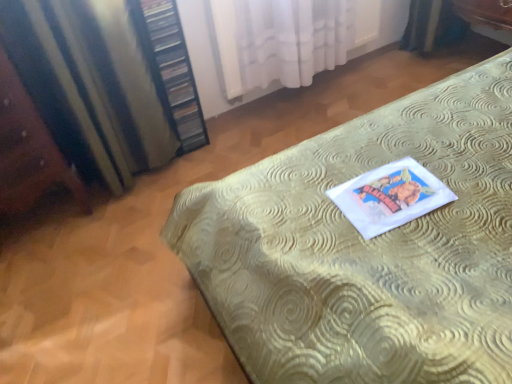
How much space does white sheer curtain at upper center, which appears as the 1th curtain when viewed from the right, occupy horizontally?

The width of white sheer curtain at upper center, which appears as the 1th curtain when viewed from the right, is 3.00 inches.

Describe the element at coordinates (366, 247) in the screenshot. I see `gold textured bed at center` at that location.

What do you see at coordinates (28, 150) in the screenshot? The width and height of the screenshot is (512, 384). I see `brown wooden vanity at left` at bounding box center [28, 150].

Describe the element at coordinates (172, 69) in the screenshot. I see `wooden bookshelf at left` at that location.

The image size is (512, 384). I want to click on white sheer curtain at upper center, which appears as the 1th curtain when viewed from the right, so click(280, 40).

Locate an element on the screen. curtain that is on the right side of satin striped curtain at left, which is the 1th curtain in left-to-right order is located at coordinates (280, 40).

Which object is closer to the camera, satin striped curtain at left, positioned as the second curtain in right-to-left order, or white sheer curtain at upper center, which appears as the 1th curtain when viewed from the right?

satin striped curtain at left, positioned as the second curtain in right-to-left order, is closer to the camera.

Between satin striped curtain at left, which is the 1th curtain in left-to-right order, and white sheer curtain at upper center, which appears as the 1th curtain when viewed from the right, which one appears on the right side from the viewer's perspective?

Positioned to the right is white sheer curtain at upper center, which appears as the 1th curtain when viewed from the right.

From the image's perspective, between satin striped curtain at left, which is the 1th curtain in left-to-right order, and white sheer curtain at upper center, which is the second curtain from left to right, which one is located above?

white sheer curtain at upper center, which is the second curtain from left to right, from the image's perspective.

Is wooden bookshelf at left positioned beyond the bounds of brown wooden vanity at left?

wooden bookshelf at left lies outside brown wooden vanity at left's area.

From a real-world perspective, is wooden bookshelf at left physically located above or below brown wooden vanity at left?

wooden bookshelf at left is situated lower than brown wooden vanity at left in the real world.

Which of these two, wooden bookshelf at left or brown wooden vanity at left, is smaller?

Smaller between the two is wooden bookshelf at left.

Could you measure the distance between wooden bookshelf at left and white sheer curtain at upper center, which is the second curtain from left to right?

wooden bookshelf at left and white sheer curtain at upper center, which is the second curtain from left to right, are 16.35 inches apart.

From a real-world perspective, is wooden bookshelf at left below white sheer curtain at upper center, which appears as the 1th curtain when viewed from the right?

Incorrect, from a real-world perspective, wooden bookshelf at left is higher than white sheer curtain at upper center, which appears as the 1th curtain when viewed from the right.

Does wooden bookshelf at left lie in front of white sheer curtain at upper center, which is the second curtain from left to right?

Yes, it is.

In the scene shown: Which object is positioned more to the right, wooden bookshelf at left or white sheer curtain at upper center, which is the second curtain from left to right?

From the viewer's perspective, white sheer curtain at upper center, which is the second curtain from left to right, appears more on the right side.

Is brown wooden vanity at left not close to wooden bookshelf at left?

They are positioned close to each other.

Between brown wooden vanity at left and wooden bookshelf at left, which one has larger width?

Wider between the two is brown wooden vanity at left.

Considering their positions, is brown wooden vanity at left located in front of or behind wooden bookshelf at left?

Visually, brown wooden vanity at left is located in front of wooden bookshelf at left.

Considering the sizes of objects white sheer curtain at upper center, which is the second curtain from left to right, and brown wooden vanity at left in the image provided, who is shorter, white sheer curtain at upper center, which is the second curtain from left to right, or brown wooden vanity at left?

white sheer curtain at upper center, which is the second curtain from left to right.

Is white sheer curtain at upper center, which appears as the 1th curtain when viewed from the right, oriented away from brown wooden vanity at left?

No, white sheer curtain at upper center, which appears as the 1th curtain when viewed from the right, is not facing away from brown wooden vanity at left.

From a real-world perspective, is white sheer curtain at upper center, which appears as the 1th curtain when viewed from the right, located higher than brown wooden vanity at left?

No, from a real-world perspective, white sheer curtain at upper center, which appears as the 1th curtain when viewed from the right, is not over brown wooden vanity at left

Can you tell me how much white sheer curtain at upper center, which is the second curtain from left to right, and brown wooden vanity at left differ in facing direction?

The angle between the facing direction of white sheer curtain at upper center, which is the second curtain from left to right, and the facing direction of brown wooden vanity at left is 0.646 degrees.

Which of these two, brown wooden vanity at left or gold textured bed at center, is bigger?

With larger size is gold textured bed at center.

Is point (46, 168) closer or farther from the camera than point (423, 292)?

Point (46, 168) is farther from the camera than point (423, 292).

Which object is positioned more to the right, brown wooden vanity at left or gold textured bed at center?

gold textured bed at center.

Does satin striped curtain at left, positioned as the second curtain in right-to-left order, touch brown wooden vanity at left?

No, satin striped curtain at left, positioned as the second curtain in right-to-left order, is not touching brown wooden vanity at left.

Considering the positions of objects satin striped curtain at left, positioned as the second curtain in right-to-left order, and brown wooden vanity at left in the image provided, who is behind, satin striped curtain at left, positioned as the second curtain in right-to-left order, or brown wooden vanity at left?

satin striped curtain at left, positioned as the second curtain in right-to-left order, is behind.

Considering the relative sizes of satin striped curtain at left, positioned as the second curtain in right-to-left order, and brown wooden vanity at left in the image provided, is satin striped curtain at left, positioned as the second curtain in right-to-left order, shorter than brown wooden vanity at left?

No.

Locate an element on the screen. curtain below the white sheer curtain at upper center, which appears as the 1th curtain when viewed from the right (from the image's perspective) is located at coordinates (89, 85).

In the image, there is a brown wooden vanity at left. Where is `bookshelf above it (from the image's perspective)`? This screenshot has height=384, width=512. bookshelf above it (from the image's perspective) is located at coordinates (172, 69).

From the image, which object appears to be farther from brown wooden vanity at left, wooden bookshelf at left or gold textured bed at center?

The object further to brown wooden vanity at left is gold textured bed at center.

From the image, which object appears to be farther from gold textured bed at center, brown wooden vanity at left or satin striped curtain at left, positioned as the second curtain in right-to-left order?

Result: brown wooden vanity at left lies further to gold textured bed at center than the other object.

Considering their positions, is satin striped curtain at left, which is the 1th curtain in left-to-right order, positioned closer to wooden bookshelf at left than gold textured bed at center?

satin striped curtain at left, which is the 1th curtain in left-to-right order, lies closer to wooden bookshelf at left than the other object.

When comparing their distances from wooden bookshelf at left, does brown wooden vanity at left or white sheer curtain at upper center, which appears as the 1th curtain when viewed from the right, seem further?

brown wooden vanity at left lies further to wooden bookshelf at left than the other object.

Based on their spatial positions, is brown wooden vanity at left or white sheer curtain at upper center, which is the second curtain from left to right, further from satin striped curtain at left, positioned as the second curtain in right-to-left order?

Based on the image, white sheer curtain at upper center, which is the second curtain from left to right, appears to be further to satin striped curtain at left, positioned as the second curtain in right-to-left order.

Looking at the image, which one is located further to white sheer curtain at upper center, which appears as the 1th curtain when viewed from the right, wooden bookshelf at left or gold textured bed at center?

gold textured bed at center is further to white sheer curtain at upper center, which appears as the 1th curtain when viewed from the right.

When comparing their distances from white sheer curtain at upper center, which appears as the 1th curtain when viewed from the right, does gold textured bed at center or satin striped curtain at left, positioned as the second curtain in right-to-left order, seem further?

Based on the image, gold textured bed at center appears to be further to white sheer curtain at upper center, which appears as the 1th curtain when viewed from the right.

Estimate the real-world distances between objects in this image. Which object is further from wooden bookshelf at left, gold textured bed at center or satin striped curtain at left, positioned as the second curtain in right-to-left order?

Among the two, gold textured bed at center is located further to wooden bookshelf at left.

At what (x,y) coordinates should I click in order to perform the action: click on vanity located between gold textured bed at center and white sheer curtain at upper center, which appears as the 1th curtain when viewed from the right, in the depth direction. Please return your answer as a coordinate pair (x, y). The image size is (512, 384). Looking at the image, I should click on (28, 150).

Identify the location of bookshelf between brown wooden vanity at left and gold textured bed at center. The image size is (512, 384). (172, 69).

Image resolution: width=512 pixels, height=384 pixels. I want to click on bookshelf between gold textured bed at center and white sheer curtain at upper center, which appears as the 1th curtain when viewed from the right, along the z-axis, so click(172, 69).

Find the location of a particular element. This screenshot has width=512, height=384. curtain between gold textured bed at center and white sheer curtain at upper center, which is the second curtain from left to right, in the front-back direction is located at coordinates (89, 85).